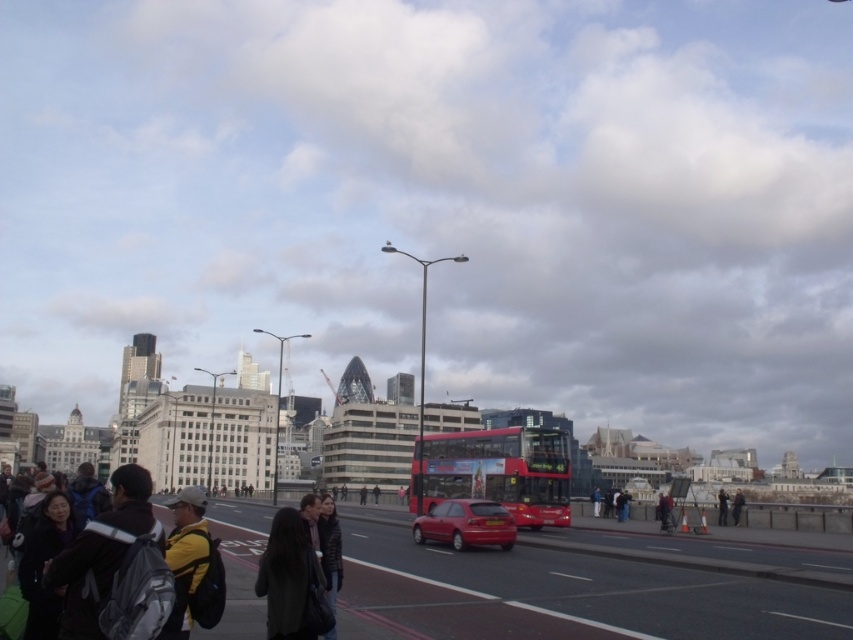
Can you confirm if red metallic bus at center is positioned below shiny red car at center?

No.

Does red metallic bus at center have a smaller size compared to shiny red car at center?

Incorrect, red metallic bus at center is not smaller in size than shiny red car at center.

You are a GUI agent. You are given a task and a screenshot of the screen. Output one action in this format:
    pyautogui.click(x=<x>, y=<y>)
    Task: Click on the red metallic bus at center
    
    Given the screenshot: What is the action you would take?
    pyautogui.click(x=496, y=472)

Where is `red metallic bus at center`? The image size is (853, 640). red metallic bus at center is located at coordinates (496, 472).

Which is below, yellow fabric jacket at lower left or dark gray jacket at center?

dark gray jacket at center is below.

Which of these two, yellow fabric jacket at lower left or dark gray jacket at center, stands shorter?

yellow fabric jacket at lower left

Who is more forward, (163, 627) or (718, 506)?

Point (163, 627)

Identify the location of yellow fabric jacket at lower left. (192, 566).

Can you confirm if red metallic bus at center is positioned to the left of dark gray coat at center?

In fact, red metallic bus at center is to the right of dark gray coat at center.

Which is in front, point (502, 472) or point (276, 531)?

Positioned in front is point (276, 531).

You are a GUI agent. You are given a task and a screenshot of the screen. Output one action in this format:
    pyautogui.click(x=<x>, y=<y>)
    Task: Click on the red metallic bus at center
    This screenshot has height=640, width=853.
    Given the screenshot: What is the action you would take?
    pyautogui.click(x=496, y=472)